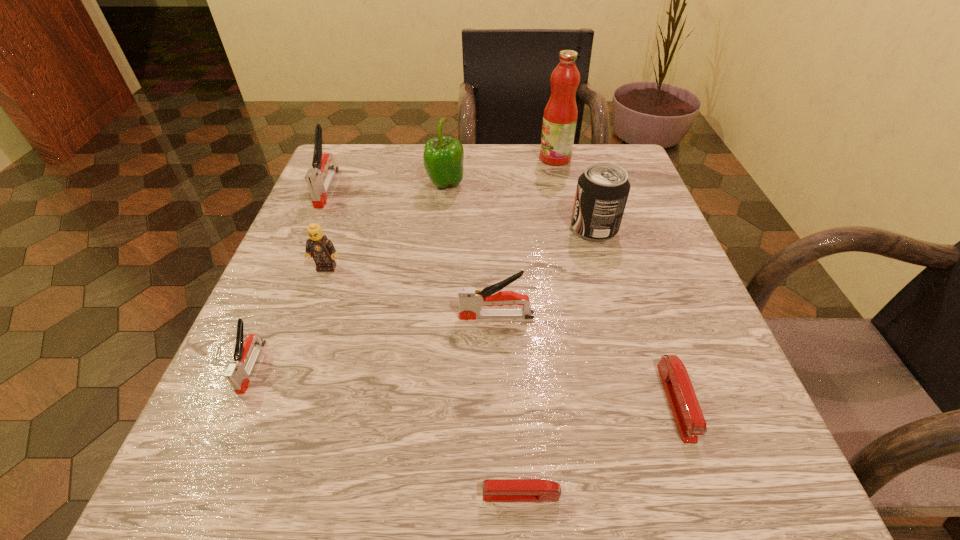
Where is `object that is at the far right corner`? object that is at the far right corner is located at coordinates (560, 115).

Locate an element on the screen. This screenshot has height=540, width=960. object located at the near right corner is located at coordinates (690, 421).

In order to click on vacant space at the far edge of the desktop in this screenshot , I will do pyautogui.click(x=545, y=183).

You are a GUI agent. You are given a task and a screenshot of the screen. Output one action in this format:
    pyautogui.click(x=<x>, y=<y>)
    Task: Click on the free space at the near edge
    
    Given the screenshot: What is the action you would take?
    pyautogui.click(x=383, y=477)

In the image, there is a desktop. Where is `vacant space at the left edge`? The image size is (960, 540). vacant space at the left edge is located at coordinates (276, 316).

The width and height of the screenshot is (960, 540). I want to click on blank space at the right edge, so click(x=636, y=258).

This screenshot has width=960, height=540. Find the location of `free location at the far left corner of the desktop`. free location at the far left corner of the desktop is located at coordinates (375, 168).

In the image, there is a desktop. Identify the location of blank space at the near left corner. This screenshot has height=540, width=960. (311, 462).

Find the location of `vacant space at the far right corner of the desktop`. vacant space at the far right corner of the desktop is located at coordinates (643, 197).

Where is `free space between the third shortest stapler and the eighth tallest object`? The image size is (960, 540). free space between the third shortest stapler and the eighth tallest object is located at coordinates (464, 384).